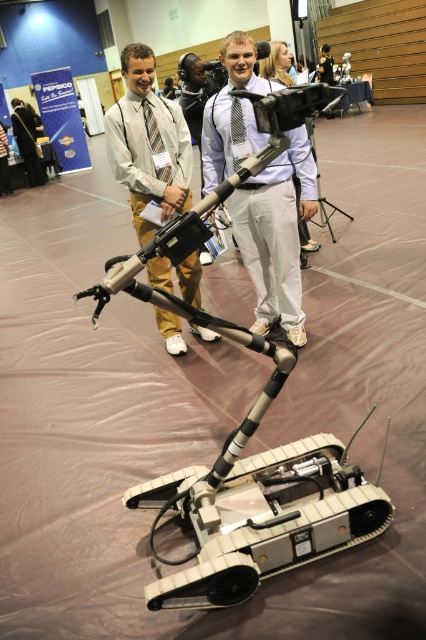
Question: Which object is closer to the camera taking this photo?

Choices:
 (A) matte black tie at left
 (B) black leather jacket at center

Answer: (A)

Question: Based on their relative distances, which object is farther from the black leather jacket at center?

Choices:
 (A) black plastic tripod at center
 (B) light blue shirt at center
 (C) matte khaki pants at center
 (D) matte black tie at left

Answer: (B)

Question: Which object is farther from the camera taking this photo?

Choices:
 (A) black leather jacket at center
 (B) light blue shirt at center
 (C) black plastic tripod at center
 (D) matte black tie at left

Answer: (A)

Question: Can you confirm if matte khaki pants at center is positioned to the left of matte black tie at left?

Choices:
 (A) no
 (B) yes

Answer: (A)

Question: Does matte black tie at left appear under black plastic tripod at center?

Choices:
 (A) yes
 (B) no

Answer: (B)

Question: Does matte khaki pants at center have a lesser width compared to matte black tie at left?

Choices:
 (A) no
 (B) yes

Answer: (A)